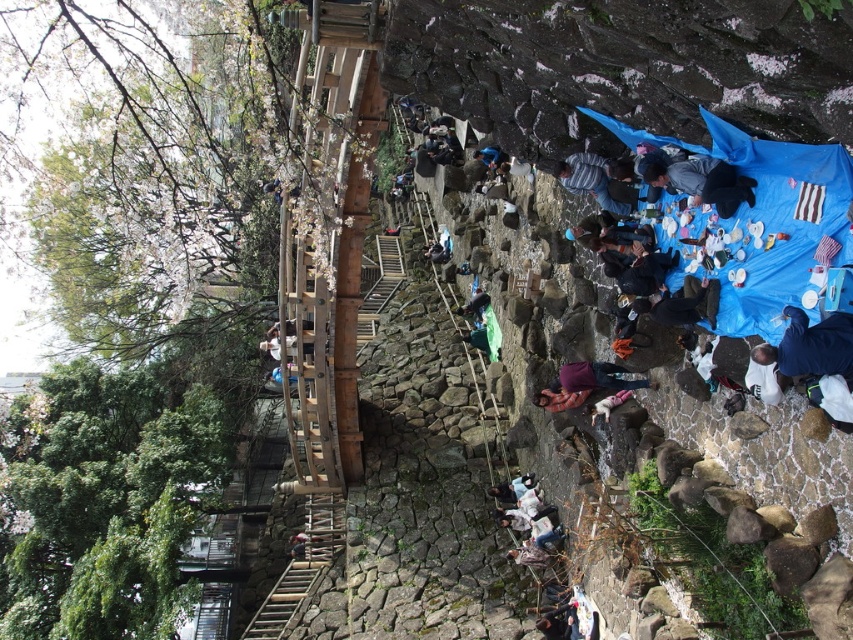
You are standing at the entrance of the garden and see both the dark blue fabric at center and the purple fabric at center. Which fabric is closer to you?

The dark blue fabric at center is closer to you since it is in front of the purple fabric at center.